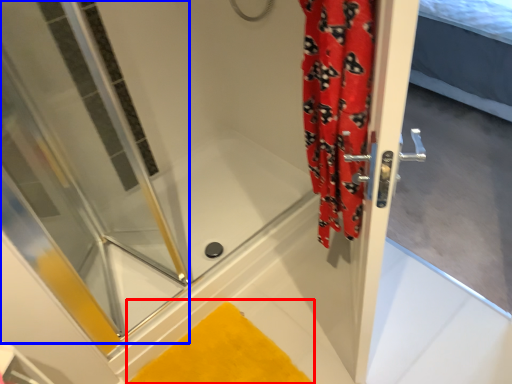
Question: Which of the following is the closest to the observer, bath mat (highlighted by a red box) or shower door (highlighted by a blue box)?

Choices:
 (A) bath mat
 (B) shower door

Answer: (B)